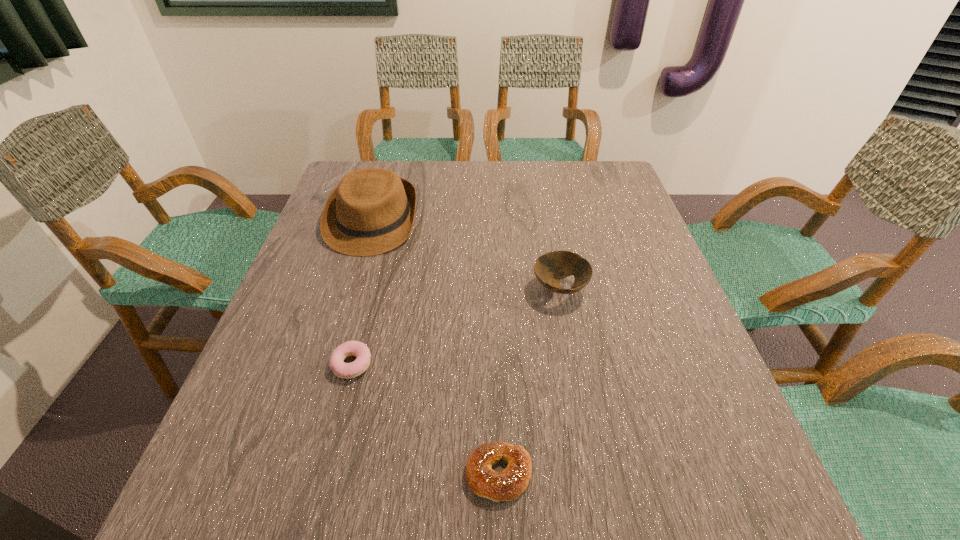
This screenshot has width=960, height=540. Identify the location of the tallest object. (371, 211).

Where is `fedora`? The height and width of the screenshot is (540, 960). fedora is located at coordinates (371, 211).

In order to click on the rightmost object in this screenshot , I will do `click(549, 268)`.

Find the location of a particular element. The width and height of the screenshot is (960, 540). bowl is located at coordinates (549, 268).

Where is `doughnut`? doughnut is located at coordinates (358, 349).

The image size is (960, 540). Identify the location of the third object from left to right. (507, 485).

Where is `bagel`? Image resolution: width=960 pixels, height=540 pixels. bagel is located at coordinates (507, 485).

Identify the location of vacant space located on the front-facing side of the farthest object. This screenshot has height=540, width=960. (337, 339).

Where is `free space located on the left of the rightmost object`? free space located on the left of the rightmost object is located at coordinates (414, 289).

This screenshot has height=540, width=960. I want to click on vacant space positioned 0.210m on the front of the third farthest object, so click(x=318, y=500).